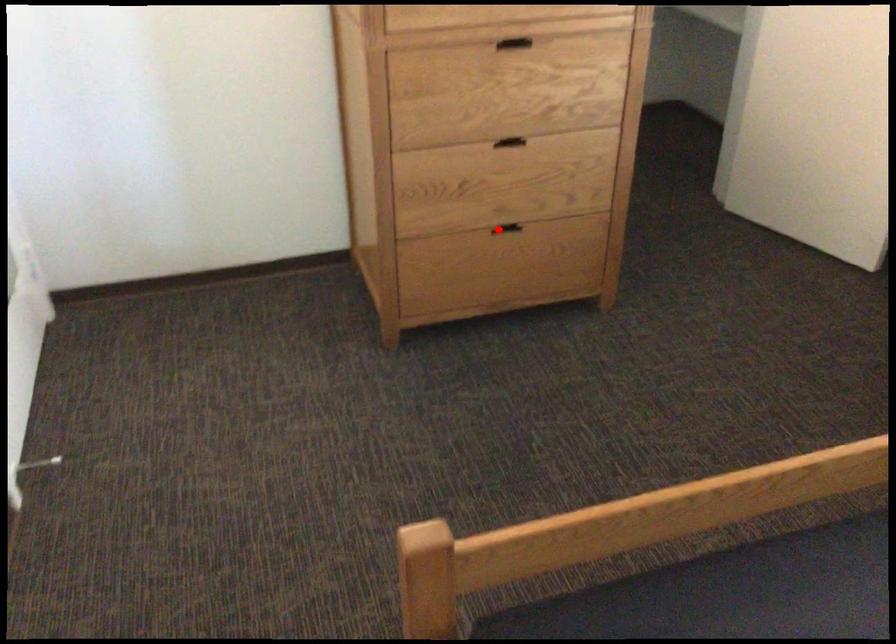
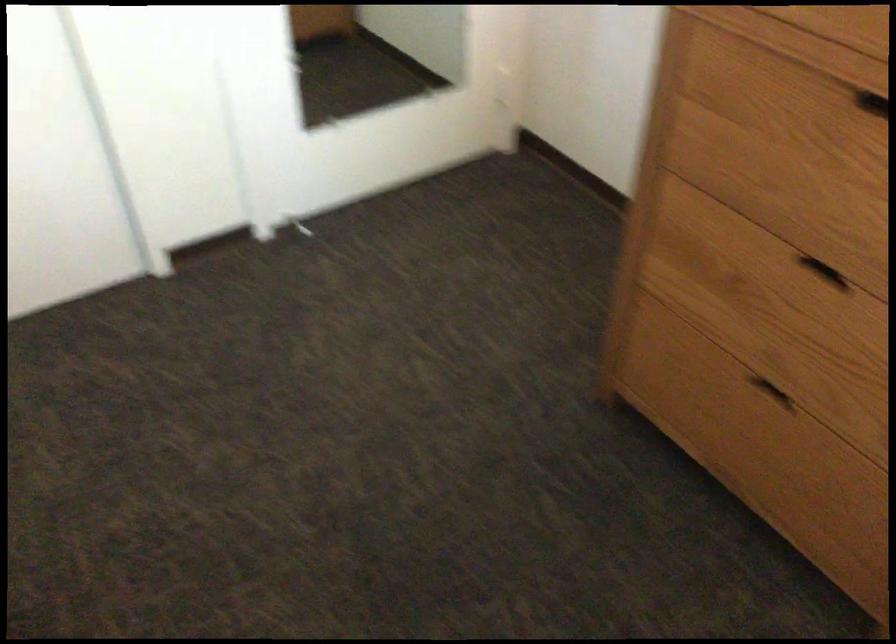
Question: I am providing you with two images of the same scene from different viewpoints. A red point is shown in image1. For the corresponding object point in image2, is it positioned nearer or farther from the camera?

Choices:
 (A) Nearer
 (B) Farther

Answer: (A)